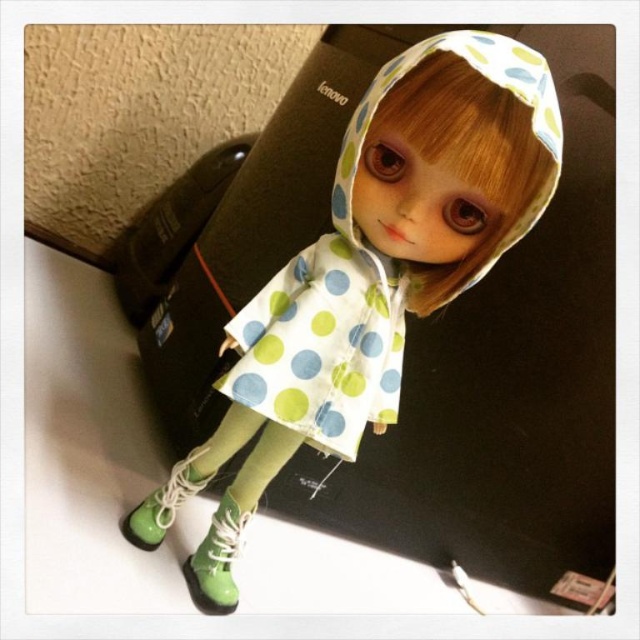
Does polka dot fabric dress at center have a larger size compared to green glossy boot at lower left?

Indeed, polka dot fabric dress at center has a larger size compared to green glossy boot at lower left.

Does polka dot fabric dress at center have a lesser height compared to green glossy boot at lower left?

No, polka dot fabric dress at center is not shorter than green glossy boot at lower left.

Identify the location of polka dot fabric dress at center. The height and width of the screenshot is (640, 640). (323, 346).

Does white polka dot fabric at center appear under polka dot fabric dress at center?

No, white polka dot fabric at center is not below polka dot fabric dress at center.

Measure the distance between white polka dot fabric at center and polka dot fabric dress at center.

white polka dot fabric at center and polka dot fabric dress at center are 2.14 inches apart from each other.

Image resolution: width=640 pixels, height=640 pixels. What do you see at coordinates (388, 248) in the screenshot? I see `white polka dot fabric at center` at bounding box center [388, 248].

The image size is (640, 640). What are the coordinates of `white polka dot fabric at center` in the screenshot? It's located at (388, 248).

Is white polka dot fabric at center above green rubber boot at lower left?

Indeed, white polka dot fabric at center is positioned over green rubber boot at lower left.

Can you confirm if white polka dot fabric at center is smaller than green rubber boot at lower left?

Incorrect, white polka dot fabric at center is not smaller in size than green rubber boot at lower left.

What are the coordinates of `white polka dot fabric at center` in the screenshot? It's located at (388, 248).

This screenshot has height=640, width=640. What are the coordinates of `white polka dot fabric at center` in the screenshot? It's located at (388, 248).